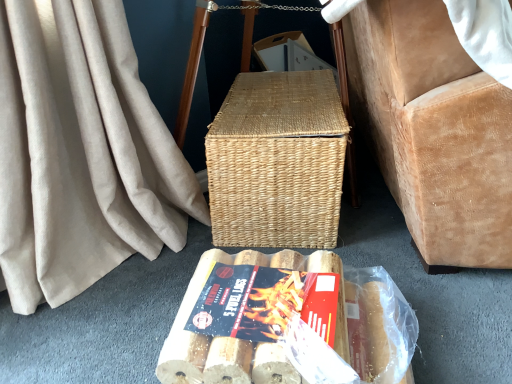
Locate an element on the screen. The width and height of the screenshot is (512, 384). vacant region to the left of wooden logs at lower center is located at coordinates (109, 326).